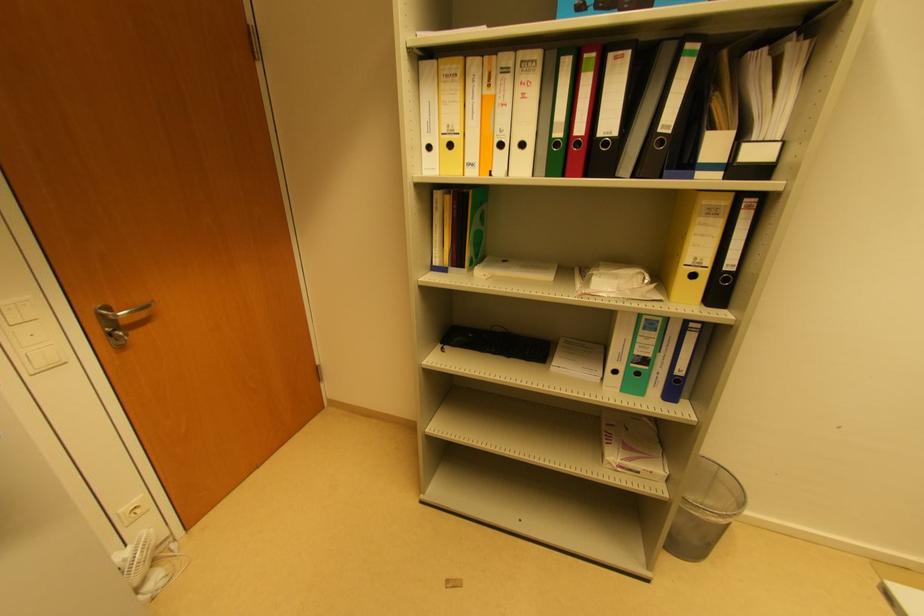
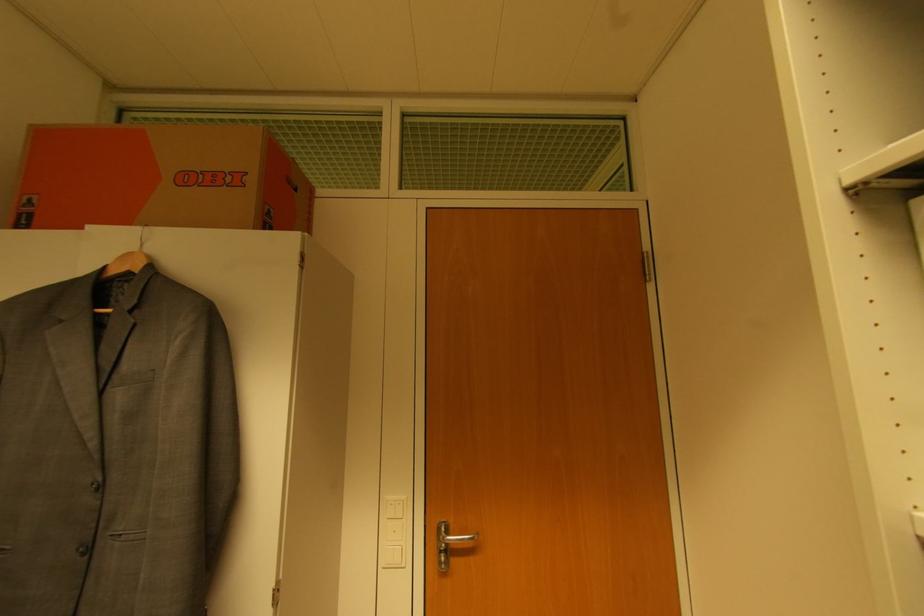
First-person continuous shooting, in which direction is the camera rotating?

The camera rotated toward left-up.